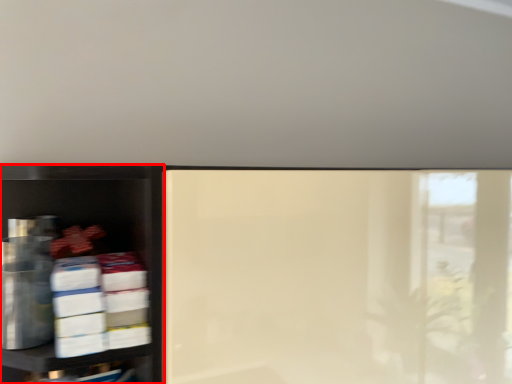
Question: From the image's perspective, what is the correct spatial relationship of shelf (annotated by the red box) in relation to shelf?

Choices:
 (A) below
 (B) above

Answer: (B)